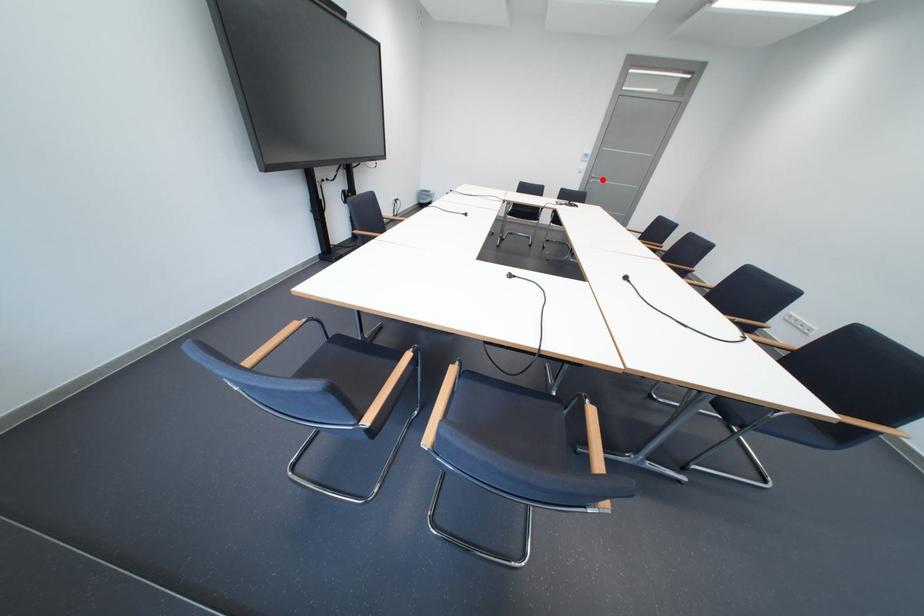
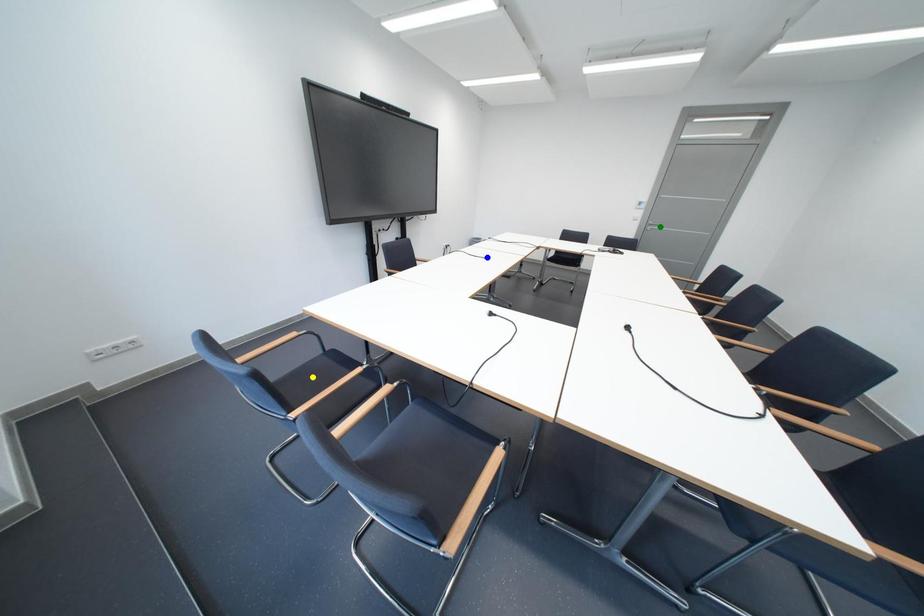
Question: I am providing you with two images of the same scene from different viewpoints. A red point is marked on the first image. You are given multiple points on the second image. Which mark in image 2 goes with the point in image 1?

Choices:
 (A) yellow point
 (B) green point
 (C) blue point

Answer: (B)